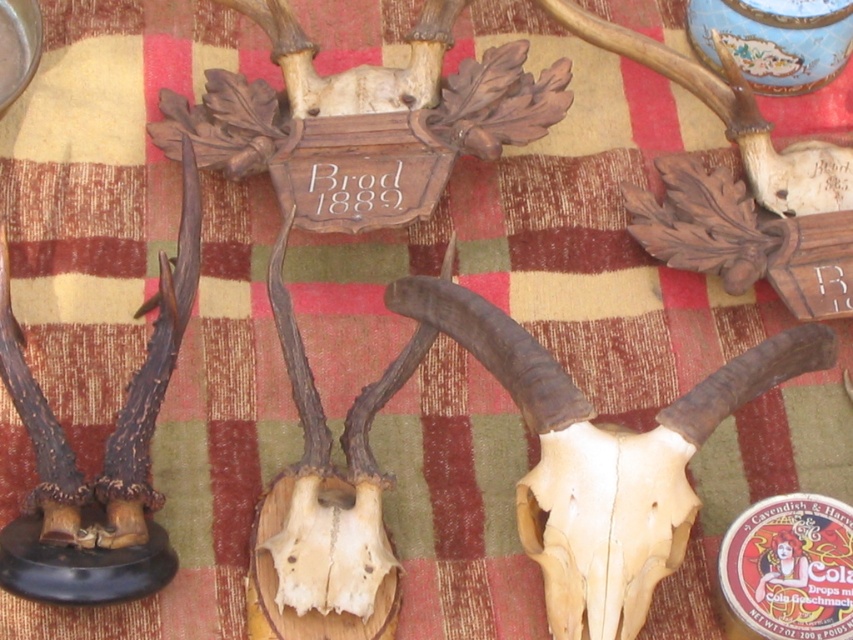
From the picture: Is bone at center smaller than bone/smooth/skull at center?

No.

This screenshot has width=853, height=640. What do you see at coordinates (602, 458) in the screenshot?
I see `bone at center` at bounding box center [602, 458].

Image resolution: width=853 pixels, height=640 pixels. What are the coordinates of `bone at center` in the screenshot? It's located at (602, 458).